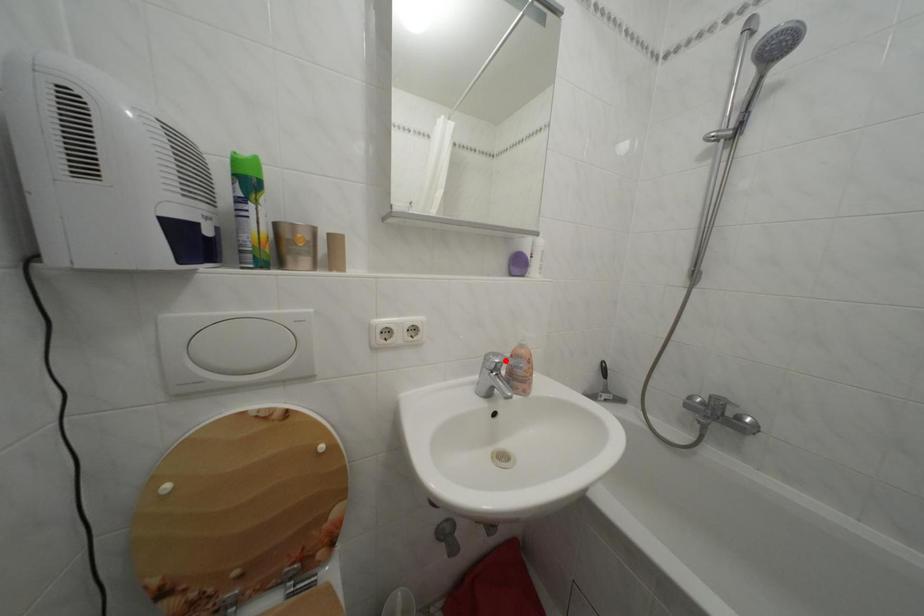
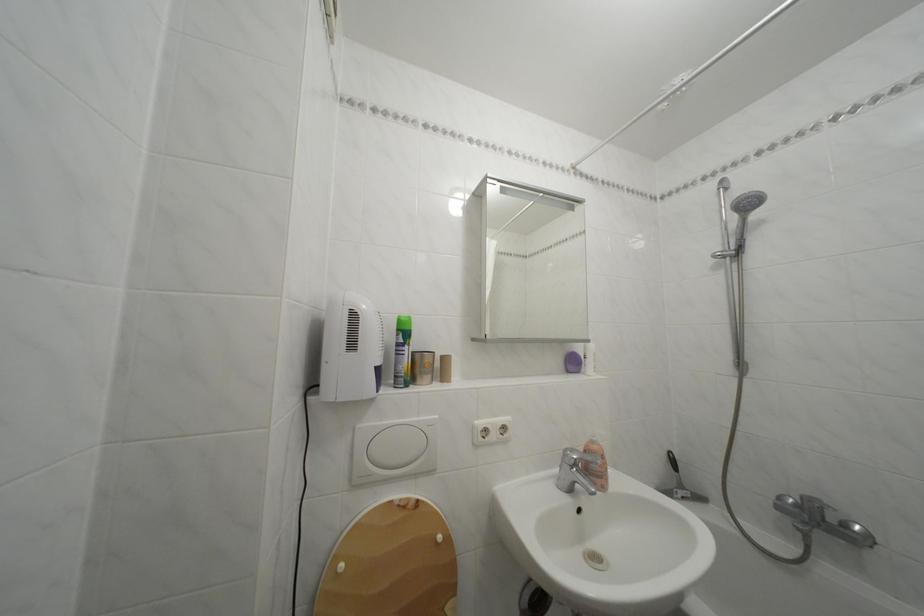
The point at the highlighted location is marked in the first image. Where is the corresponding point in the second image?

(581, 456)